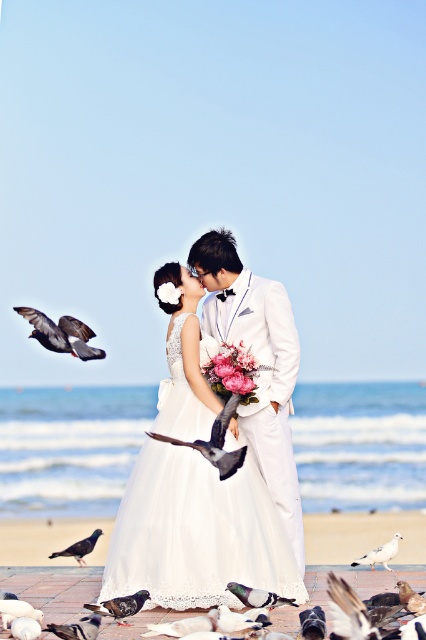
Is point (276, 388) positioned in front of point (273, 604)?

No.

Is white satin suit at center behind gray feathered pigeon at lower center?

Yes, it is behind gray feathered pigeon at lower center.

Locate an element on the screen. The width and height of the screenshot is (426, 640). white satin suit at center is located at coordinates (259, 358).

The height and width of the screenshot is (640, 426). What do you see at coordinates (259, 358) in the screenshot?
I see `white satin suit at center` at bounding box center [259, 358].

Is point (287, 314) farther from viewer compared to point (396, 532)?

That is True.

Is point (265, 292) farther from camera compared to point (397, 538)?

Yes, point (265, 292) is farther from viewer.

This screenshot has width=426, height=640. What are the coordinates of `white satin suit at center` in the screenshot? It's located at pos(259,358).

Is smooth gray pigeon at lower left behind white feathered bird at center?

No, smooth gray pigeon at lower left is in front of white feathered bird at center.

Which is above, smooth gray pigeon at lower left or white feathered bird at center?

Positioned higher is white feathered bird at center.

Image resolution: width=426 pixels, height=640 pixels. Describe the element at coordinates (17, 611) in the screenshot. I see `smooth gray pigeon at lower left` at that location.

Find the location of a particular element. The width and height of the screenshot is (426, 640). smooth gray pigeon at lower left is located at coordinates (17, 611).